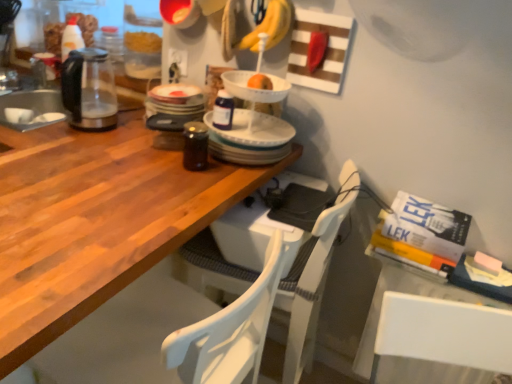
Question: Which direction should I rotate to look at white plastic chair at center, acting as the second chair starting from the front, — up or down?

Choices:
 (A) up
 (B) down

Answer: (B)

Question: Is the position of wooden table at center less distant than that of white wood chair at lower left, the 1th chair in the front-to-back sequence?

Choices:
 (A) yes
 (B) no

Answer: (A)

Question: Does wooden table at center touch white wood chair at lower left, the 1th chair in the front-to-back sequence?

Choices:
 (A) no
 (B) yes

Answer: (A)

Question: Is wooden table at center to the left of white wood chair at lower left, the 1th chair in the front-to-back sequence, from the viewer's perspective?

Choices:
 (A) no
 (B) yes

Answer: (B)

Question: From the image's perspective, is wooden table at center on white wood chair at lower left, acting as the second chair starting from the back?

Choices:
 (A) no
 (B) yes

Answer: (B)

Question: Is wooden table at center shorter than white wood chair at lower left, the 1th chair in the front-to-back sequence?

Choices:
 (A) no
 (B) yes

Answer: (A)

Question: From a real-world perspective, does wooden table at center stand above white wood chair at lower left, the 1th chair in the front-to-back sequence?

Choices:
 (A) yes
 (B) no

Answer: (B)

Question: Is transparent glass kettle at left far from wooden table at center?

Choices:
 (A) yes
 (B) no

Answer: (B)

Question: Is transparent glass kettle at left to the left of wooden table at center from the viewer's perspective?

Choices:
 (A) no
 (B) yes

Answer: (B)

Question: Does transparent glass kettle at left have a lesser width compared to wooden table at center?

Choices:
 (A) yes
 (B) no

Answer: (A)

Question: Is transparent glass kettle at left positioned behind wooden table at center?

Choices:
 (A) yes
 (B) no

Answer: (A)

Question: Does transparent glass kettle at left have a larger size compared to wooden table at center?

Choices:
 (A) yes
 (B) no

Answer: (B)

Question: From the image's perspective, is transparent glass kettle at left located beneath wooden table at center?

Choices:
 (A) no
 (B) yes

Answer: (A)

Question: Is white plastic chair at center, which ranks as the first chair in back-to-front order, positioned far away from wooden table at center?

Choices:
 (A) yes
 (B) no

Answer: (B)